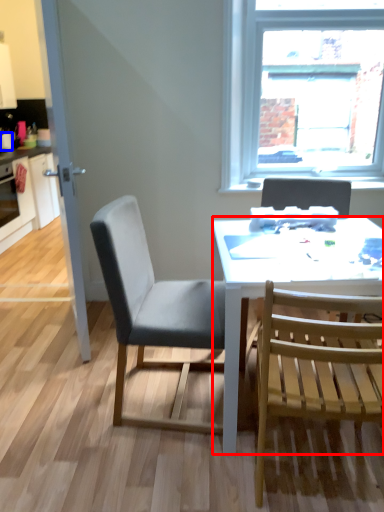
Question: Which of the following is the farthest to the observer, desk (highlighted by a red box) or coffee cup (highlighted by a blue box)?

Choices:
 (A) desk
 (B) coffee cup

Answer: (B)